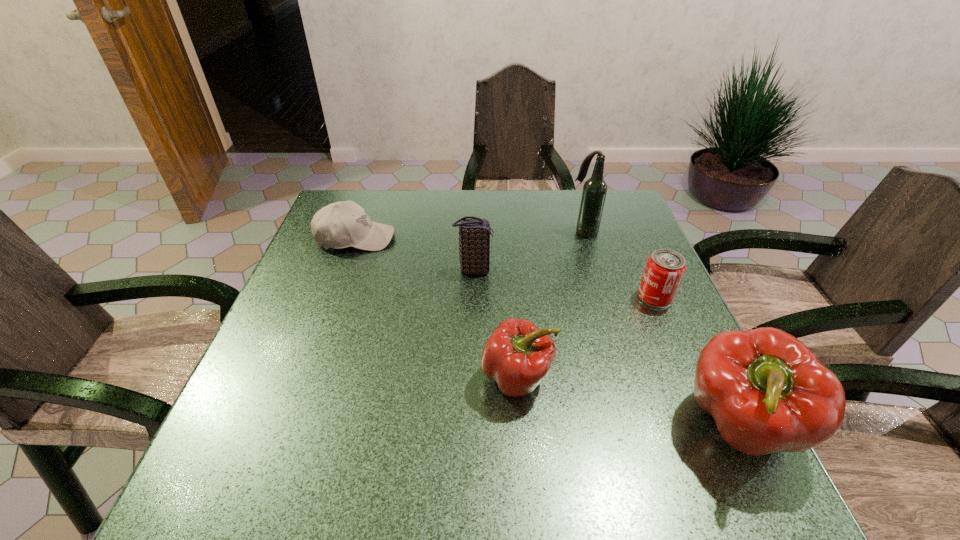
Where is `the left pepper`? The width and height of the screenshot is (960, 540). the left pepper is located at coordinates (517, 355).

This screenshot has width=960, height=540. I want to click on the right pepper, so click(766, 390).

Identify the location of the taller pepper. The width and height of the screenshot is (960, 540). (766, 390).

Find the location of a particular element. Image resolution: width=960 pixels, height=540 pixels. the fourth farthest object is located at coordinates (665, 268).

Locate an element on the screen. the tallest object is located at coordinates (594, 191).

Where is `the third object from right to left`? The image size is (960, 540). the third object from right to left is located at coordinates (594, 191).

Locate an element on the screen. The height and width of the screenshot is (540, 960). the third farthest object is located at coordinates (474, 234).

I want to click on baseball cap, so click(345, 224).

Locate an element on the screen. The width and height of the screenshot is (960, 540). vacant space located 0.290m on the back of the shorter pepper is located at coordinates (509, 263).

At what (x,y) coordinates should I click in order to perform the action: click on free location located 0.290m on the back of the second tallest object. Please return your answer as a coordinate pair (x, y). Looking at the image, I should click on (669, 283).